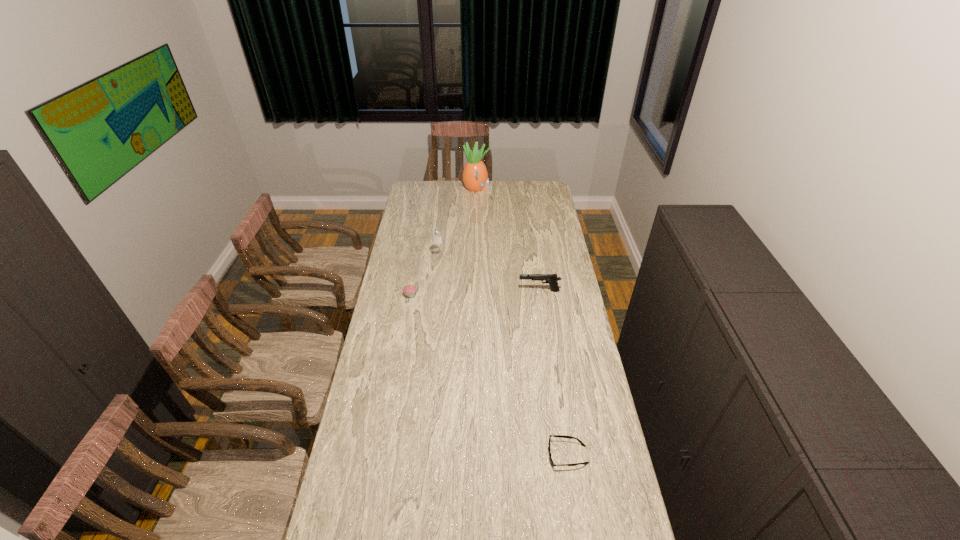
The height and width of the screenshot is (540, 960). Identify the location of the tallest object. (475, 176).

This screenshot has height=540, width=960. Find the location of `the third object from left to right`. the third object from left to right is located at coordinates (475, 176).

You are a GUI agent. You are given a task and a screenshot of the screen. Output one action in this format:
    pyautogui.click(x=<x>, y=<y>)
    Task: Click on the second farthest object
    The width and height of the screenshot is (960, 540).
    Given the screenshot: What is the action you would take?
    pyautogui.click(x=436, y=233)

Where is `the second tallest object`? The width and height of the screenshot is (960, 540). the second tallest object is located at coordinates (436, 233).

Where is `gun`? gun is located at coordinates (551, 279).

Where is `the leftmost object`? the leftmost object is located at coordinates (409, 290).

Where is `the second shortest object`? the second shortest object is located at coordinates (409, 290).

Where is `the nearest object`? Image resolution: width=960 pixels, height=540 pixels. the nearest object is located at coordinates (560, 436).

Find the location of a particular element. The height and width of the screenshot is (540, 960). the shortest object is located at coordinates (560, 436).

The image size is (960, 540). Identify the location of vacant space located at the entrance of the tallest object. (535, 188).